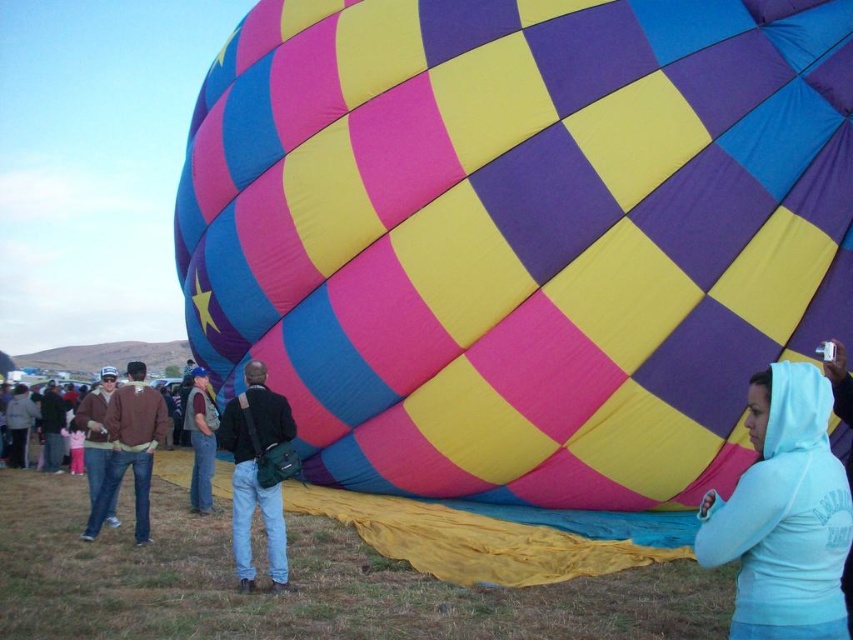
You are standing at the point labeled as point (520, 234) in the image. What object are you directly facing?

The point (520, 234) indicates checkered fabric balloon at center, so you are directly facing the checkered fabric balloon at center.

You are a photographer at the hot air balloon festival. You want to capture a photo where both the checkered fabric balloon at center and the dark blue leather jacket at center are visible. Based on their positions, which object should you focus on first to ensure both are in the frame?

The checkered fabric balloon at center is above the dark blue leather jacket at center, so you should focus on the checkered fabric balloon at center first to ensure both are in the frame.